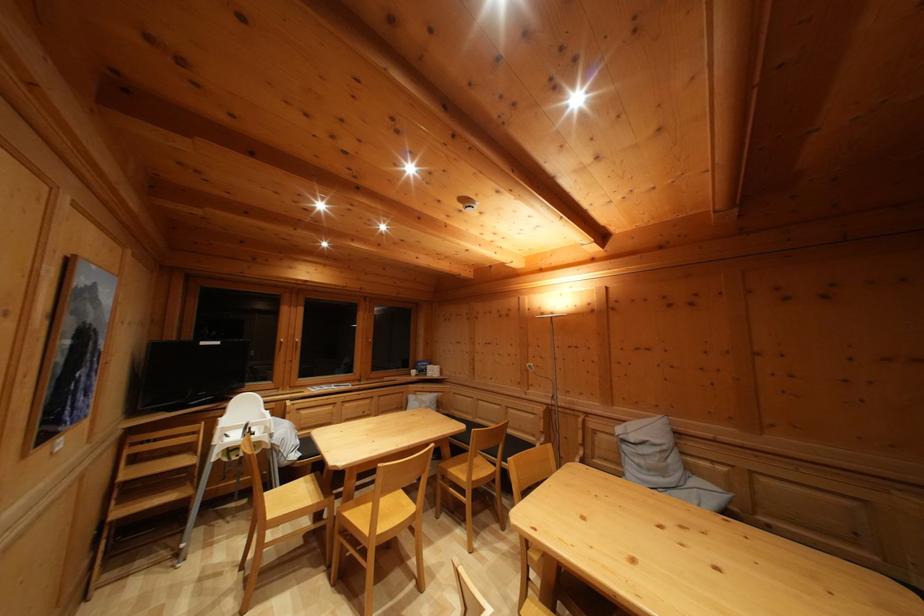
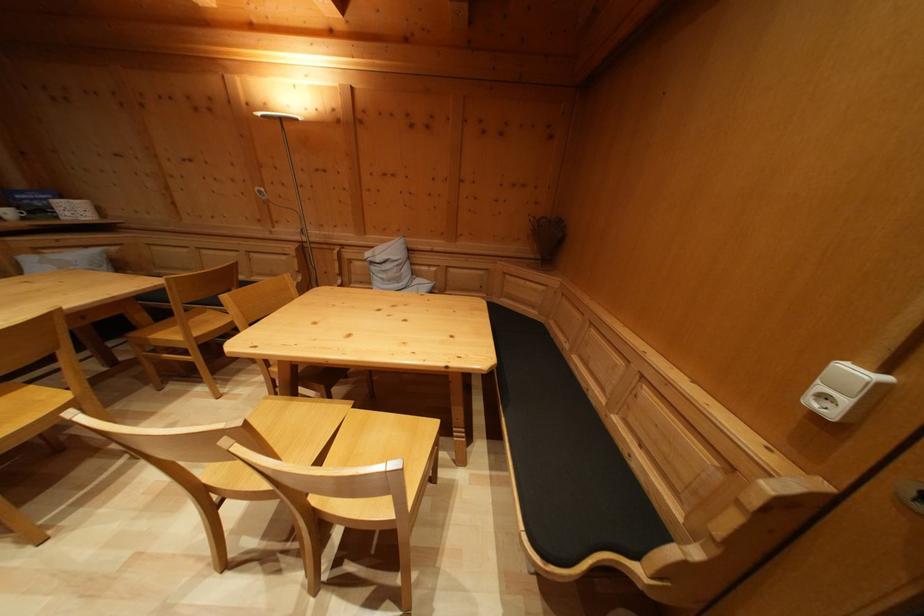
Where in the second image is the point corresponding to (419,379) from the first image?

(14, 219)